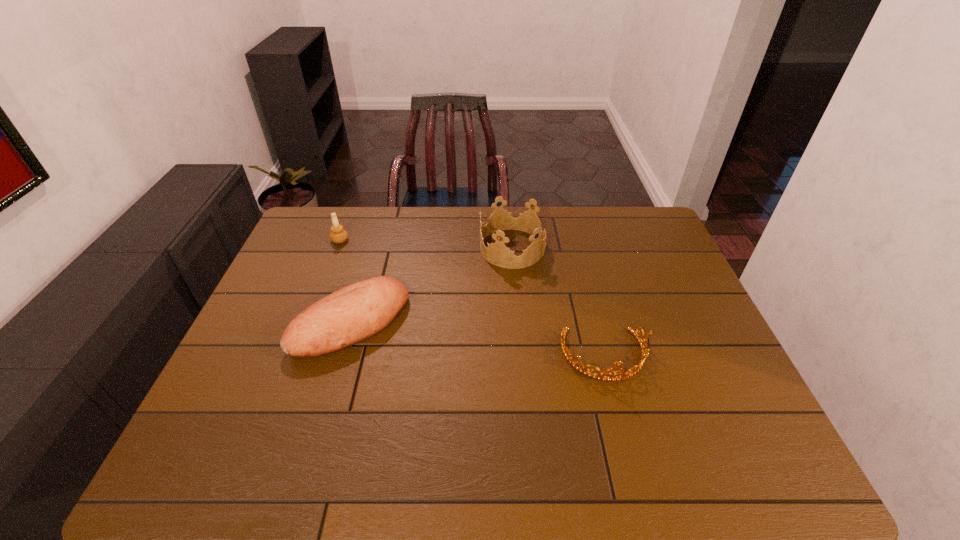
The width and height of the screenshot is (960, 540). In the image, there is a desktop. What are the coordinates of `free space at the far right corner` in the screenshot? It's located at (621, 222).

Where is `vacant space at the near right corner`? The height and width of the screenshot is (540, 960). vacant space at the near right corner is located at coordinates (726, 445).

Find the location of a particular element. Image resolution: width=960 pixels, height=540 pixels. empty space that is in between the shorter tiara and the bread is located at coordinates (478, 339).

The height and width of the screenshot is (540, 960). Identify the location of vacant space in between the candle_holder and the taller tiara. (426, 244).

This screenshot has height=540, width=960. I want to click on free space between the bread and the nearer tiara, so click(478, 339).

The width and height of the screenshot is (960, 540). What are the coordinates of `empty space that is in between the nearer tiara and the candle_holder` in the screenshot? It's located at (472, 298).

Identify the location of empty location between the bread and the nearer tiara. Image resolution: width=960 pixels, height=540 pixels. (478, 339).

Where is `vacant area that lies between the candle_holder and the tallest object`? This screenshot has width=960, height=540. vacant area that lies between the candle_holder and the tallest object is located at coordinates (426, 244).

This screenshot has width=960, height=540. I want to click on free area in between the candle_holder and the bread, so click(346, 281).

Locate an element on the screen. This screenshot has width=960, height=540. empty space that is in between the bread and the farther tiara is located at coordinates (432, 285).